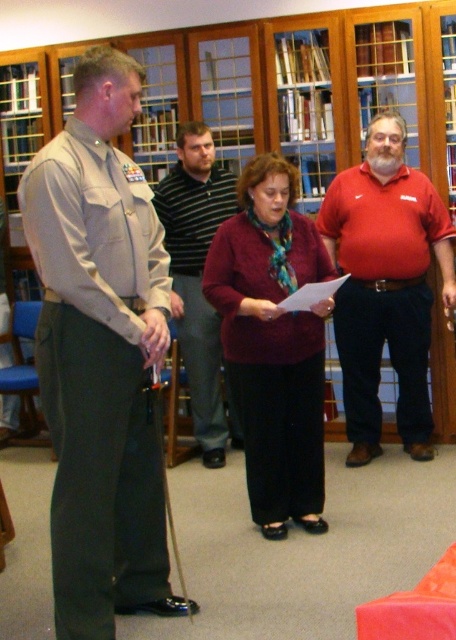
Question: Is maroon sweater at center closer to camera compared to striped cotton shirt at center?

Choices:
 (A) yes
 (B) no

Answer: (A)

Question: Which object is the farthest from the matte red shirt at right?

Choices:
 (A) maroon sweater at center
 (B) khaki uniform at left

Answer: (B)

Question: Which of the following is the farthest from the observer?

Choices:
 (A) khaki uniform at left
 (B) maroon sweater at center
 (C) matte red shirt at right
 (D) striped cotton shirt at center

Answer: (D)

Question: Among these points, which one is nearest to the camera?

Choices:
 (A) (216, 321)
 (B) (421, 202)
 (C) (53, 577)

Answer: (C)

Question: Is khaki uniform at left to the left of maroon sweater at center from the viewer's perspective?

Choices:
 (A) no
 (B) yes

Answer: (B)

Question: Is maroon sweater at center bigger than striped cotton shirt at center?

Choices:
 (A) yes
 (B) no

Answer: (B)